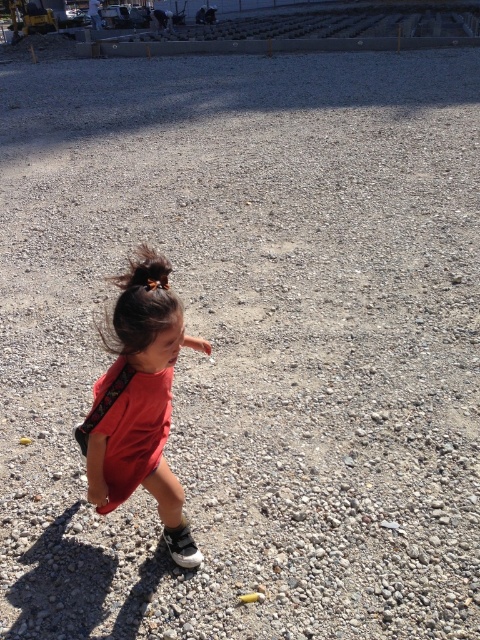
You are a photographer trying to capture the child in the red cotton dress at center and the brown shiny hair at upper left. Which object is located to the left of the other?

The red cotton dress at center is positioned on the left side of brown shiny hair at upper left.

You are a photographer trying to capture a photo of the child in the scene. You notice the matte red dress at center and the brown shiny hair at upper left. Which object is positioned higher in the image?

The matte red dress at center is much taller than the brown shiny hair at upper left, so the matte red dress at center is positioned higher in the image.